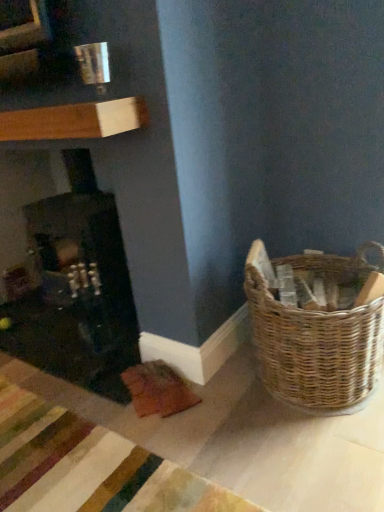
Question: Does matte black fireplace at left come in front of woven brown basket at lower right?

Choices:
 (A) no
 (B) yes

Answer: (A)

Question: Would you say matte black fireplace at left is a long distance from woven brown basket at lower right?

Choices:
 (A) yes
 (B) no

Answer: (B)

Question: Is woven brown basket at lower right inside matte black fireplace at left?

Choices:
 (A) yes
 (B) no

Answer: (B)

Question: From the image's perspective, is matte black fireplace at left under woven brown basket at lower right?

Choices:
 (A) yes
 (B) no

Answer: (B)

Question: From the image's perspective, is matte black fireplace at left on woven brown basket at lower right?

Choices:
 (A) yes
 (B) no

Answer: (A)

Question: Considering the relative sizes of matte black fireplace at left and woven brown basket at lower right in the image provided, is matte black fireplace at left bigger than woven brown basket at lower right?

Choices:
 (A) yes
 (B) no

Answer: (A)

Question: Is woven brown basket at lower right located outside matte black fireplace at left?

Choices:
 (A) no
 (B) yes

Answer: (B)

Question: From the image's perspective, is woven brown basket at lower right on matte black fireplace at left?

Choices:
 (A) no
 (B) yes

Answer: (A)

Question: From a real-world perspective, is woven brown basket at lower right physically below matte black fireplace at left?

Choices:
 (A) no
 (B) yes

Answer: (B)

Question: Is the position of woven brown basket at lower right more distant than that of matte black fireplace at left?

Choices:
 (A) no
 (B) yes

Answer: (A)

Question: Would you say woven brown basket at lower right is a long distance from matte black fireplace at left?

Choices:
 (A) yes
 (B) no

Answer: (B)

Question: Is woven brown basket at lower right positioned before matte black fireplace at left?

Choices:
 (A) no
 (B) yes

Answer: (B)

Question: Considering the positions of matte black fireplace at left and woven brown basket at lower right in the image, is matte black fireplace at left bigger or smaller than woven brown basket at lower right?

Choices:
 (A) big
 (B) small

Answer: (A)